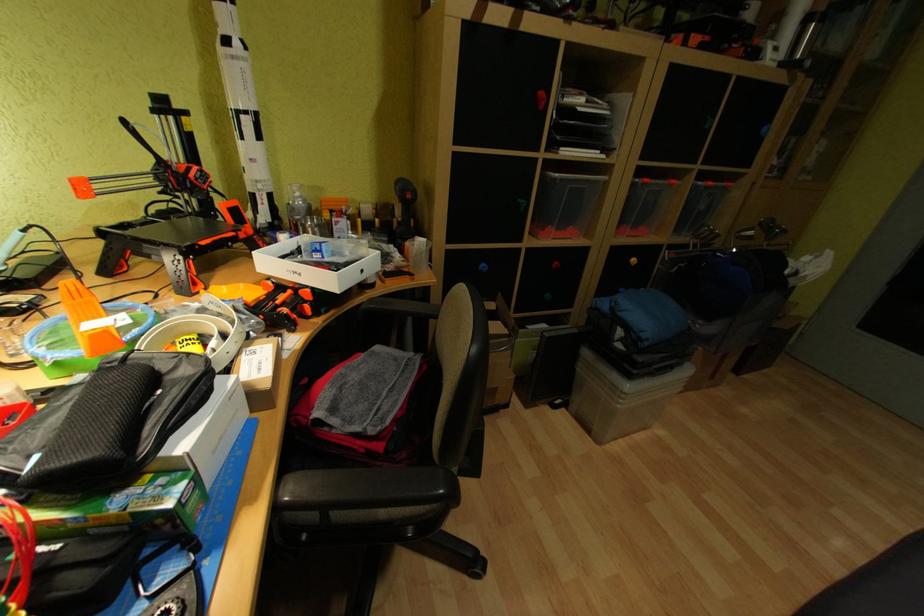
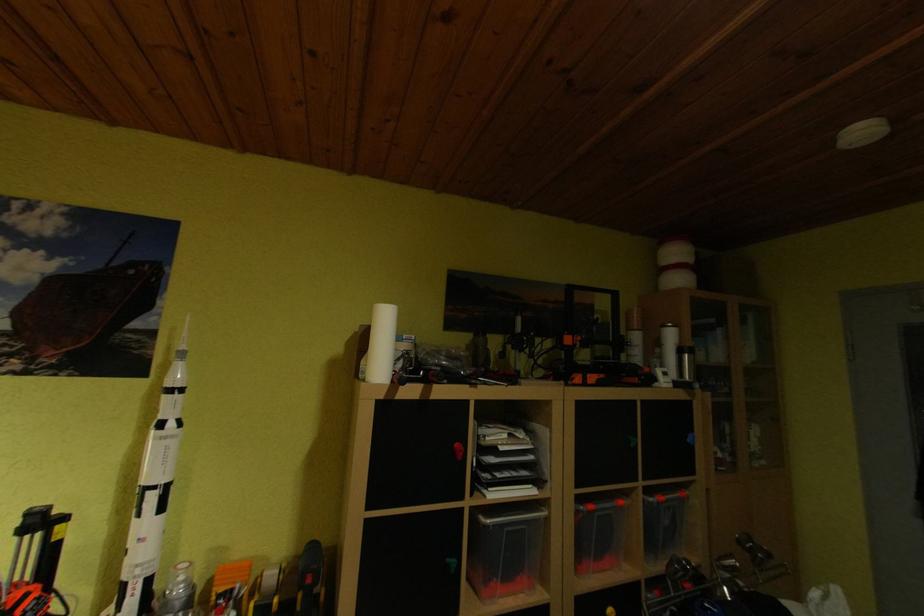
Question: The first image is from the beginning of the video and the second image is from the end. How did the camera likely rotate when shooting the video?

Choices:
 (A) Left
 (B) Right
 (C) Up
 (D) Down

Answer: (C)